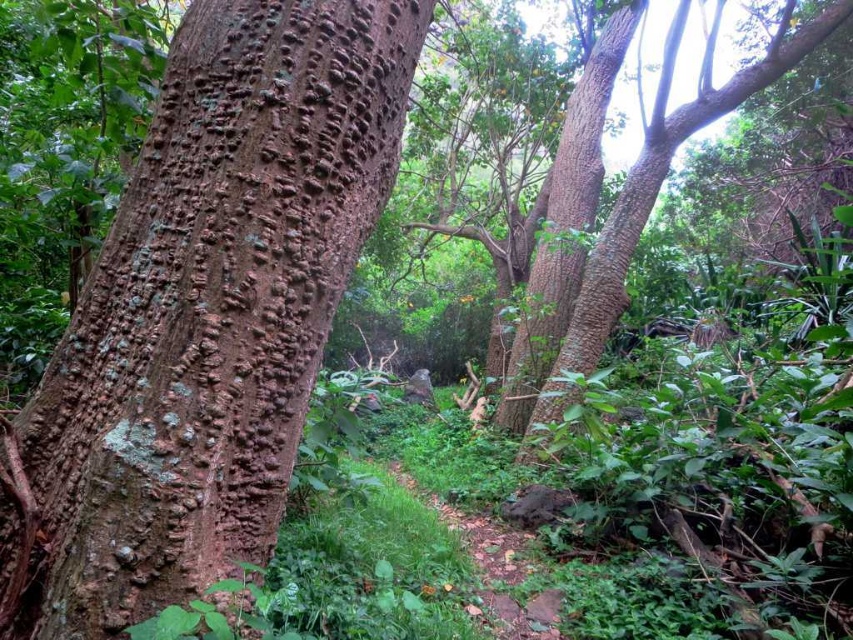
You are a hiker navigating a forest path and see both the smooth brown tree trunk at upper right and the smooth brown tree trunk at upper center. Which tree trunk is closer to you?

The smooth brown tree trunk at upper right is closer to you because it is positioned in front of the smooth brown tree trunk at upper center.

You are a hiker who has just found a tree with brown rough bark at center in the forest. If you want to mark this tree on a map using coordinates, what coordinates would you use?

The coordinates for the brown rough bark at center are point (x=204, y=314).

You are a hiker carrying a 3.5 meter long ladder through the forest. You see the brown rough bark at center and the smooth brown tree trunk at upper center. Can you fit the ladder horizontally between them without bending it?

The distance between the brown rough bark at center and the smooth brown tree trunk at upper center is 3.41 meters. Since the ladder is 3.5 meters long, it is slightly longer than the space available. Therefore, the ladder cannot be placed horizontally between them without bending it.